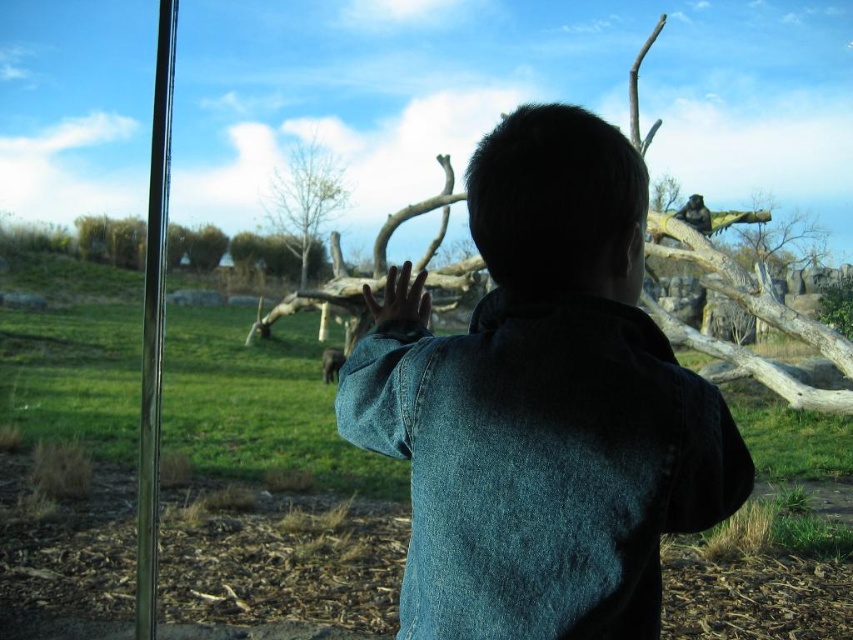
Does brown textured log at upper right have a lesser width compared to grayish-brown fur elephant at center?

No, brown textured log at upper right is not thinner than grayish-brown fur elephant at center.

Is brown textured log at upper right wider than grayish-brown fur elephant at center?

Yes.

Locate an element on the screen. Image resolution: width=853 pixels, height=640 pixels. brown textured log at upper right is located at coordinates (778, 236).

Where is `brown textured log at upper right`? brown textured log at upper right is located at coordinates (778, 236).

Which is below, brown textured log at upper right or shiny black monkey at upper right?

Positioned lower is shiny black monkey at upper right.

Who is more distant from viewer, (791, 259) or (688, 204)?

Point (791, 259)

Describe the element at coordinates (778, 236) in the screenshot. This screenshot has width=853, height=640. I see `brown textured log at upper right` at that location.

I want to click on brown textured log at upper right, so click(x=778, y=236).

Is point (311, 170) positioned before point (779, 227)?

Yes, it is.

Who is shorter, bare wood tree at upper center or brown textured log at upper right?

brown textured log at upper right

Is point (271, 173) more distant than point (750, 202)?

No, (271, 173) is closer to viewer.

The image size is (853, 640). I want to click on bare wood tree at upper center, so click(305, 196).